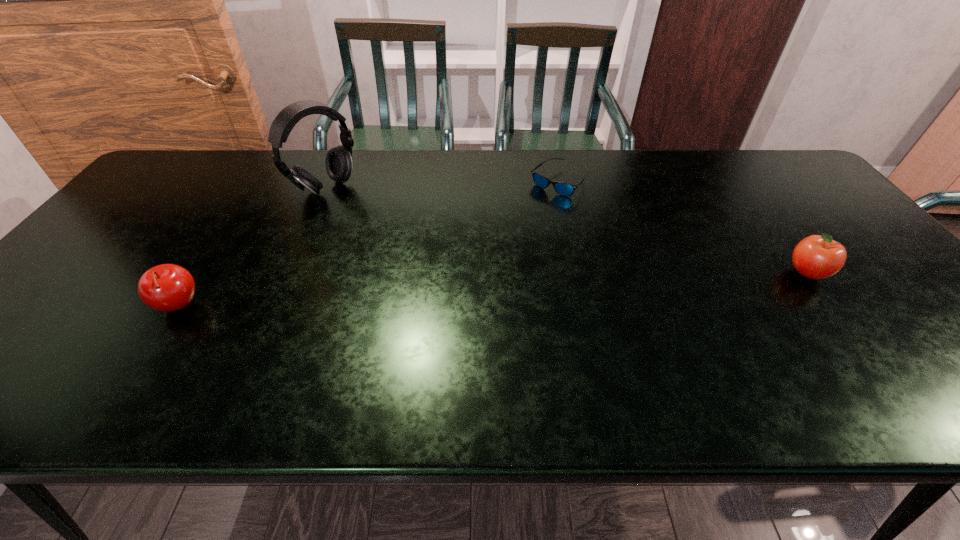
Image resolution: width=960 pixels, height=540 pixels. Identify the location of cherry. (167, 287).

At what (x,y) coordinates should I click in order to perform the action: click on the rightmost object. Please return your answer as a coordinate pair (x, y). Image resolution: width=960 pixels, height=540 pixels. Looking at the image, I should click on (819, 256).

You are a GUI agent. You are given a task and a screenshot of the screen. Output one action in this format:
    pyautogui.click(x=<x>, y=<y>)
    Task: Click on the shortest object
    The image size is (960, 540).
    Given the screenshot: What is the action you would take?
    pyautogui.click(x=565, y=189)

Identify the location of the third object from left to right. (565, 189).

What are the coordinates of `the tallest object` in the screenshot? It's located at (338, 162).

In order to click on the third object from right to left in this screenshot , I will do `click(338, 162)`.

Identify the location of free region located 0.390m on the back of the cherry. The height and width of the screenshot is (540, 960). (251, 194).

This screenshot has height=540, width=960. I want to click on vacant region located 0.340m on the back of the rightmost object, so click(x=741, y=184).

At what (x,y) coordinates should I click in order to perform the action: click on free spot located 0.090m at the front of the sunglasses showing the lenses. Please return your answer as a coordinate pair (x, y). Image resolution: width=960 pixels, height=540 pixels. Looking at the image, I should click on (567, 218).

Locate an element on the screen. vacant point located at the front of the sunglasses showing the lenses is located at coordinates (588, 299).